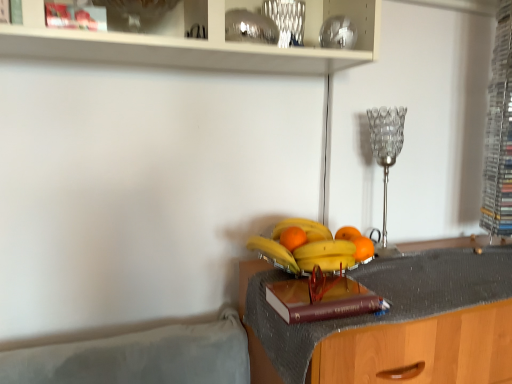
Question: From the image's perspective, is orange matte at center below yellow matte bananas at center, marked as the second banana in a bottom-to-top arrangement?

Choices:
 (A) yes
 (B) no

Answer: (B)

Question: Is orange matte at center behind yellow matte bananas at center, the second banana when ordered from top to bottom?

Choices:
 (A) no
 (B) yes

Answer: (B)

Question: From a real-world perspective, is orange matte at center located beneath yellow matte bananas at center, marked as the second banana in a bottom-to-top arrangement?

Choices:
 (A) yes
 (B) no

Answer: (B)

Question: From a real-world perspective, is orange matte at center on yellow matte bananas at center, the second banana when ordered from top to bottom?

Choices:
 (A) yes
 (B) no

Answer: (A)

Question: Is orange matte at center turned away from yellow matte bananas at center, marked as the second banana in a bottom-to-top arrangement?

Choices:
 (A) no
 (B) yes

Answer: (A)

Question: Is orange matte at center smaller than yellow matte bananas at center, marked as the second banana in a bottom-to-top arrangement?

Choices:
 (A) no
 (B) yes

Answer: (B)

Question: Is yellow matte bananas at center, the first banana when ordered from bottom to top, located outside shiny metallic vase at upper center?

Choices:
 (A) yes
 (B) no

Answer: (A)

Question: Considering the relative sizes of yellow matte bananas at center, acting as the 3th banana starting from the top, and shiny metallic vase at upper center in the image provided, is yellow matte bananas at center, acting as the 3th banana starting from the top, taller than shiny metallic vase at upper center?

Choices:
 (A) no
 (B) yes

Answer: (A)

Question: From a real-world perspective, is yellow matte bananas at center, the first banana when ordered from bottom to top, physically below shiny metallic vase at upper center?

Choices:
 (A) yes
 (B) no

Answer: (A)

Question: Is yellow matte bananas at center, the first banana when ordered from bottom to top, with shiny metallic vase at upper center?

Choices:
 (A) no
 (B) yes

Answer: (A)

Question: Is yellow matte bananas at center, the first banana when ordered from bottom to top, bigger than shiny metallic vase at upper center?

Choices:
 (A) yes
 (B) no

Answer: (A)

Question: Does yellow matte bananas at center, acting as the 3th banana starting from the top, have a greater width compared to shiny metallic vase at upper center?

Choices:
 (A) no
 (B) yes

Answer: (B)

Question: Does yellow matte banana at center, acting as the third banana starting from the bottom, have a larger size compared to orange matte at center?

Choices:
 (A) no
 (B) yes

Answer: (B)